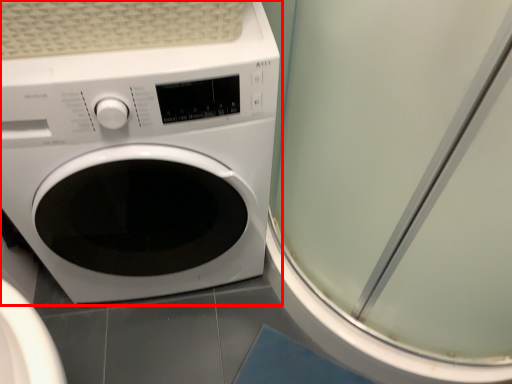
Question: Considering the relative positions of washing machine (annotated by the red box) and screen door in the image provided, where is washing machine (annotated by the red box) located with respect to the staircase?

Choices:
 (A) right
 (B) left

Answer: (B)